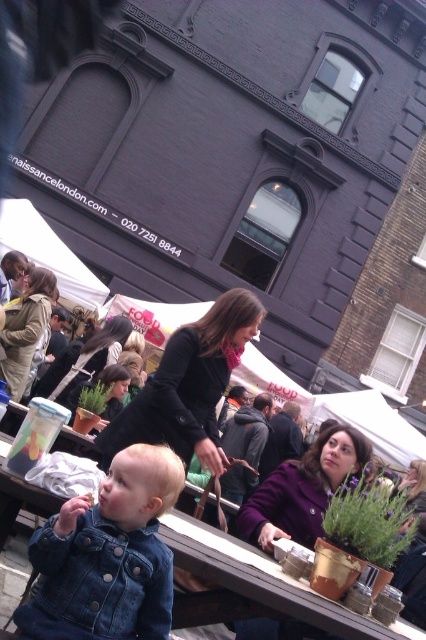
You are at the market and see a purple woolen coat at center and a tan leather jacket at center. Which one is positioned more to the right?

The purple woolen coat at center is positioned to the right of the tan leather jacket at center.

Based on the scene description, where is the faded denim jacket at lower right located in terms of coordinates?

The faded denim jacket at lower right is located at coordinates point (108, 556).

You are trying to decide which jacket to choose for a casual day out. The faded denim jacket at lower right and the matte black jacket at center are both options. Which jacket is narrower in width?

The faded denim jacket at lower right is narrower in width than the matte black jacket at center.